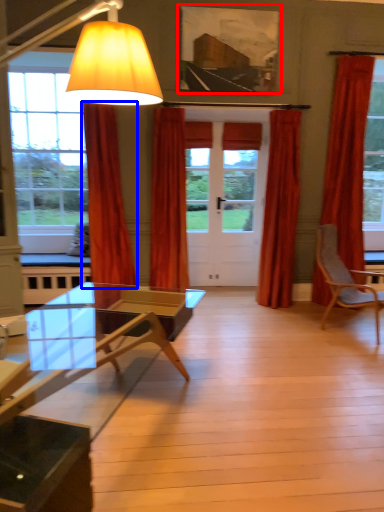
Question: Which point is further to the camera, picture frame (highlighted by a red box) or curtain (highlighted by a blue box)?

Choices:
 (A) picture frame
 (B) curtain

Answer: (A)